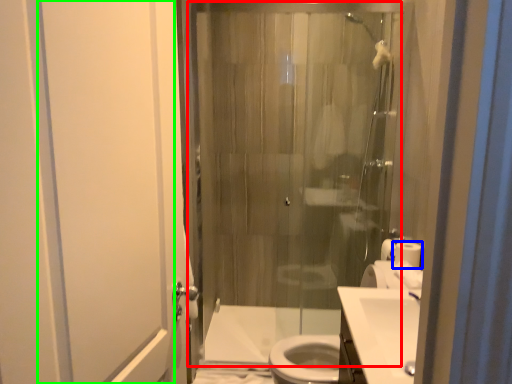
Question: Based on their relative distances, which object is farther from shower door (highlighted by a red box)? Choose from toilet paper (highlighted by a blue box) and screen door (highlighted by a green box).

Choices:
 (A) toilet paper
 (B) screen door

Answer: (B)